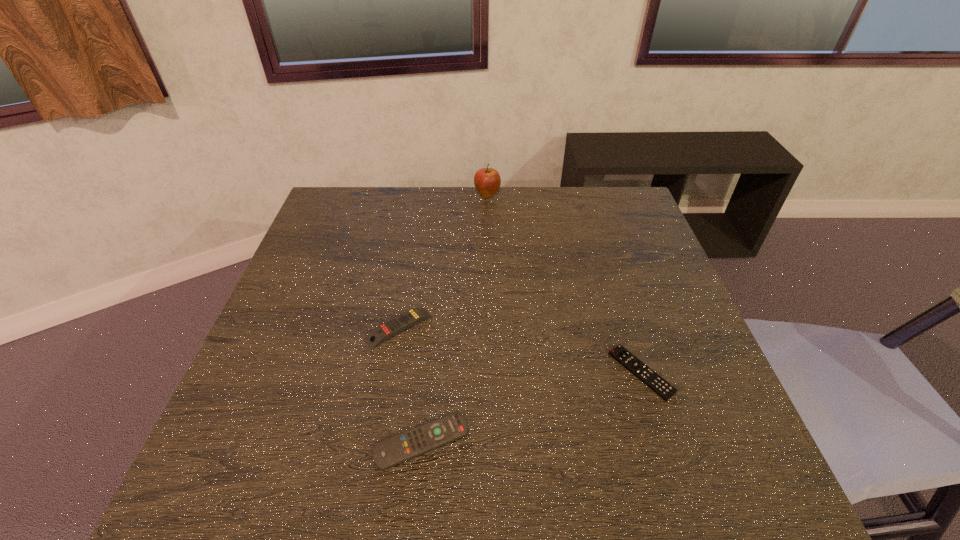
At what (x,y) coordinates should I click in order to perform the action: click on free space between the second tallest object and the farthest object. Please return your answer as a coordinate pair (x, y). This screenshot has width=960, height=540. Looking at the image, I should click on (443, 261).

Where is `vacant space in between the second object from right to left and the second tallest object`? vacant space in between the second object from right to left and the second tallest object is located at coordinates (443, 261).

This screenshot has height=540, width=960. In order to click on vacant region between the second shortest remote control and the shortest object in this screenshot , I will do `click(532, 407)`.

You are a GUI agent. You are given a task and a screenshot of the screen. Output one action in this format:
    pyautogui.click(x=<x>, y=<y>)
    Task: Click on the vacant space in between the second shortest remote control and the apple
    This screenshot has width=960, height=540.
    Given the screenshot: What is the action you would take?
    pyautogui.click(x=454, y=318)

Locate an element on the screen. vacant space that's between the rightmost object and the nearest remote control is located at coordinates (532, 407).

Find the location of a particular element. This screenshot has width=960, height=540. vacant space that's between the tallest object and the shortest object is located at coordinates (564, 284).

This screenshot has height=540, width=960. What are the coordinates of `free space between the farthest object and the shortest remote control` in the screenshot? It's located at (564, 284).

This screenshot has width=960, height=540. I want to click on free space between the tallest remote control and the shortest object, so click(520, 350).

In order to click on free space between the shortest remote control and the third tallest object in this screenshot , I will do `click(532, 407)`.

Locate which object ranks second in proximity to the tallest object. Please provide its 2D coordinates. Your answer should be formatted as a tuple, i.e. [(x, y)], where the tuple contains the x and y coordinates of a point satisfying the conditions above.

[(660, 386)]